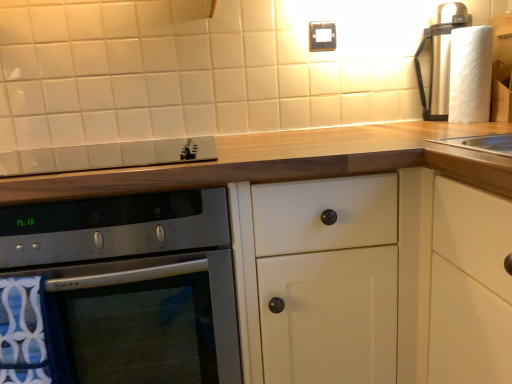
Question: Based on their sizes in the image, would you say white matte cabinet at center is bigger or smaller than satin silver gas stove at upper center?

Choices:
 (A) small
 (B) big

Answer: (B)

Question: From the image's perspective, is white matte cabinet at center above or below satin silver gas stove at upper center?

Choices:
 (A) below
 (B) above

Answer: (A)

Question: Estimate the real-world distances between objects in this image. Which object is farther from the satin silver gas stove at upper center?

Choices:
 (A) white matte cabinet at center
 (B) gold metallic electric outlet at upper center
 (C) satin silver oven at lower left
 (D) white textured paper towel at upper right

Answer: (D)

Question: Which of these objects is positioned farthest from the white textured paper towel at upper right?

Choices:
 (A) satin silver oven at lower left
 (B) satin silver gas stove at upper center
 (C) white matte cabinet at center
 (D) gold metallic electric outlet at upper center

Answer: (A)